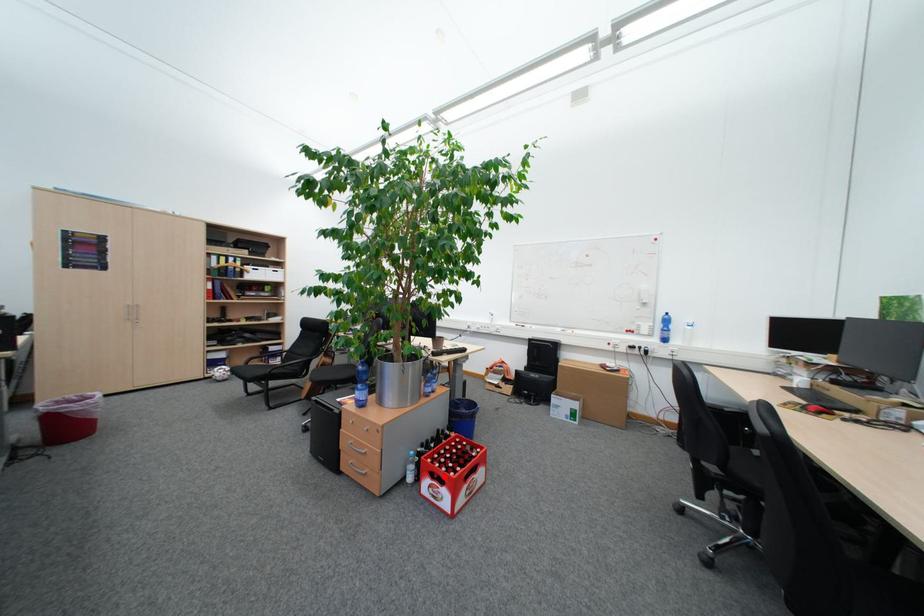
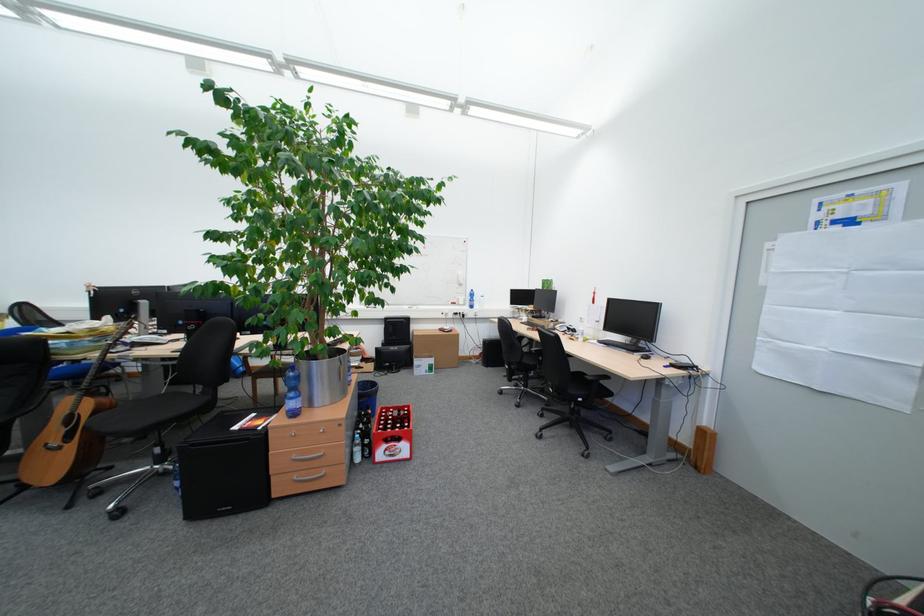
The point at the highlighted location is marked in the first image. Where is the corresponding point in the second image?

(398, 442)